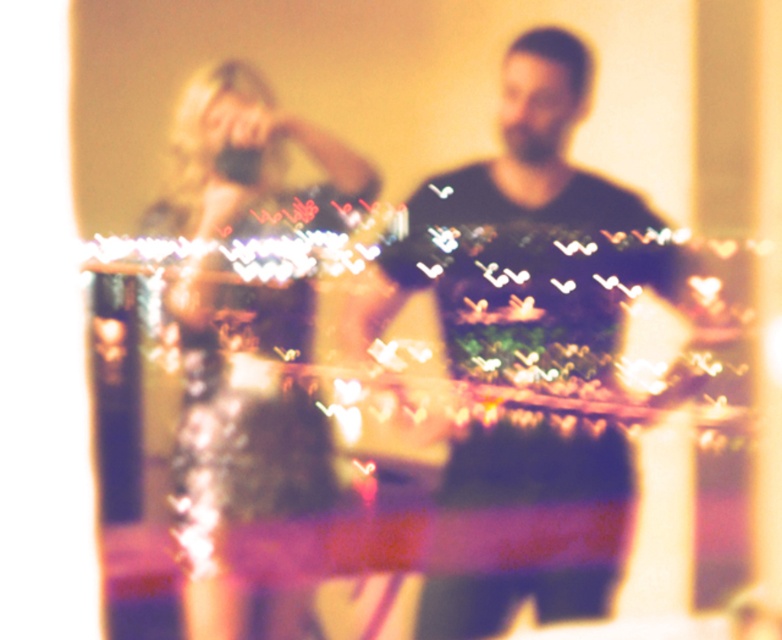
Question: From the image, what is the correct spatial relationship of dark green sweater at center in relation to shiny silver dress at center?

Choices:
 (A) below
 (B) above

Answer: (B)

Question: Which point is farther from the camera taking this photo?

Choices:
 (A) (504, 166)
 (B) (210, 157)

Answer: (A)

Question: Which of the following is the farthest from the observer?

Choices:
 (A) shiny silver dress at center
 (B) dark green sweater at center

Answer: (B)

Question: Is dark green sweater at center smaller than shiny silver dress at center?

Choices:
 (A) yes
 (B) no

Answer: (B)

Question: Is dark green sweater at center below shiny silver dress at center?

Choices:
 (A) yes
 (B) no

Answer: (B)